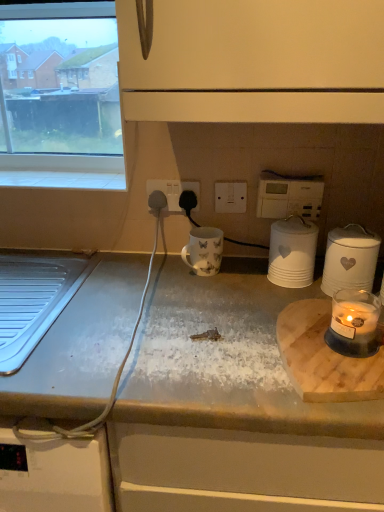
Identify the location of empty space that is ontop of white tile at upper left (from a real-world perspective). The image size is (384, 512). (64, 179).